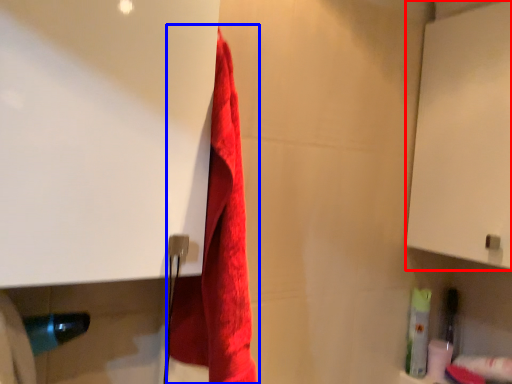
Question: Which object appears farthest to the camera in this image, screen door (highlighted by a red box) or towel (highlighted by a blue box)?

Choices:
 (A) screen door
 (B) towel

Answer: (A)